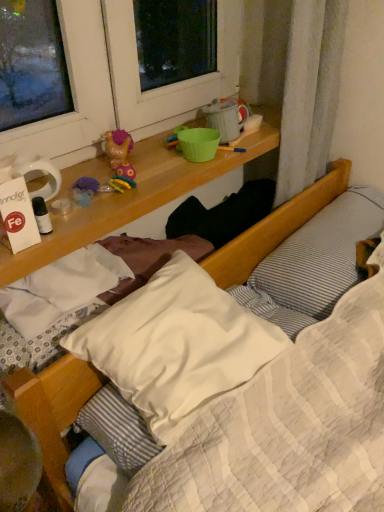
Question: Is gold plastic toy at upper center at the right side of white striped pillow at upper right, acting as the first pillow starting from the right?

Choices:
 (A) yes
 (B) no

Answer: (B)

Question: Could you tell me if gold plastic toy at upper center is facing white striped pillow at upper right, acting as the first pillow starting from the right?

Choices:
 (A) no
 (B) yes

Answer: (A)

Question: Does gold plastic toy at upper center have a lesser width compared to white striped pillow at upper right, the 2th pillow when ordered from left to right?

Choices:
 (A) yes
 (B) no

Answer: (A)

Question: Considering the relative sizes of gold plastic toy at upper center and white striped pillow at upper right, acting as the first pillow starting from the right, in the image provided, is gold plastic toy at upper center bigger than white striped pillow at upper right, acting as the first pillow starting from the right,?

Choices:
 (A) no
 (B) yes

Answer: (A)

Question: Can you confirm if gold plastic toy at upper center is positioned to the left of white striped pillow at upper right, acting as the first pillow starting from the right?

Choices:
 (A) yes
 (B) no

Answer: (A)

Question: From the image's perspective, is gold plastic toy at upper center on white striped pillow at upper right, the 2th pillow when ordered from left to right?

Choices:
 (A) yes
 (B) no

Answer: (A)

Question: Is white soft pillow at center, the first pillow from the left, bigger than gold plastic toy at upper center?

Choices:
 (A) no
 (B) yes

Answer: (B)

Question: Can you confirm if white soft pillow at center, the 2th pillow positioned from the right, is smaller than gold plastic toy at upper center?

Choices:
 (A) yes
 (B) no

Answer: (B)

Question: From the image's perspective, is white soft pillow at center, the 2th pillow positioned from the right, under gold plastic toy at upper center?

Choices:
 (A) no
 (B) yes

Answer: (B)

Question: Is white soft pillow at center, the first pillow from the left, positioned behind gold plastic toy at upper center?

Choices:
 (A) no
 (B) yes

Answer: (A)

Question: Could you tell me if white soft pillow at center, the first pillow from the left, is facing gold plastic toy at upper center?

Choices:
 (A) no
 (B) yes

Answer: (A)

Question: Is there a large distance between white soft pillow at center, the 2th pillow positioned from the right, and gold plastic toy at upper center?

Choices:
 (A) no
 (B) yes

Answer: (A)

Question: Is white soft pillow at center, the 2th pillow positioned from the right, with white striped pillow at upper right, acting as the first pillow starting from the right?

Choices:
 (A) no
 (B) yes

Answer: (A)